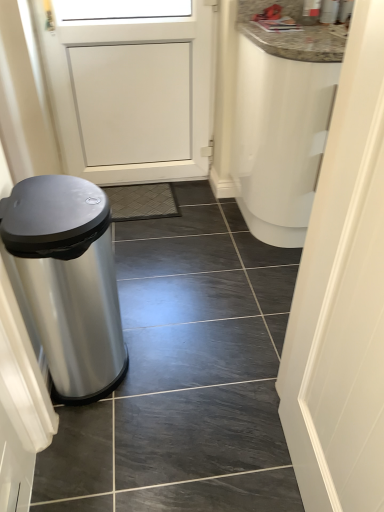
Locate an element on the screen. This screenshot has height=512, width=384. free spot above slate tile at left (from a real-world perspective) is located at coordinates (192, 246).